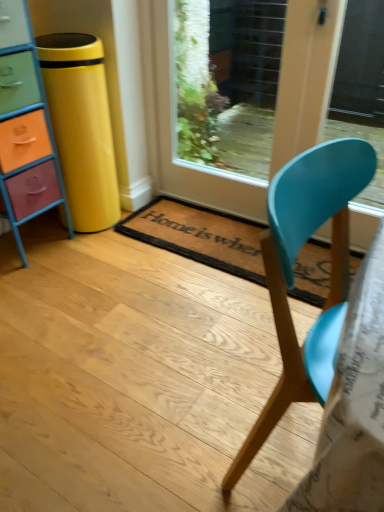
Question: Is brown coir mat at center to the right of wooden glass door at center from the viewer's perspective?

Choices:
 (A) yes
 (B) no

Answer: (B)

Question: Is the depth of brown coir mat at center less than that of wooden glass door at center?

Choices:
 (A) yes
 (B) no

Answer: (B)

Question: Considering the relative sizes of brown coir mat at center and wooden glass door at center in the image provided, is brown coir mat at center bigger than wooden glass door at center?

Choices:
 (A) no
 (B) yes

Answer: (A)

Question: From the image's perspective, is brown coir mat at center beneath wooden glass door at center?

Choices:
 (A) no
 (B) yes

Answer: (B)

Question: From a real-world perspective, is brown coir mat at center on wooden glass door at center?

Choices:
 (A) no
 (B) yes

Answer: (A)

Question: In terms of height, does matte blue chair at center look taller or shorter compared to wooden glass door at center?

Choices:
 (A) short
 (B) tall

Answer: (A)

Question: Considering the positions of matte blue chair at center and wooden glass door at center in the image, is matte blue chair at center bigger or smaller than wooden glass door at center?

Choices:
 (A) big
 (B) small

Answer: (A)

Question: In terms of width, does matte blue chair at center look wider or thinner when compared to wooden glass door at center?

Choices:
 (A) wide
 (B) thin

Answer: (A)

Question: From the image's perspective, relative to wooden glass door at center, is matte blue chair at center above or below?

Choices:
 (A) below
 (B) above

Answer: (A)

Question: From the image's perspective, is wooden glass door at center above or below multicolored painted wood chest of drawers at left?

Choices:
 (A) below
 (B) above

Answer: (B)

Question: Is wooden glass door at center to the left or to the right of multicolored painted wood chest of drawers at left in the image?

Choices:
 (A) right
 (B) left

Answer: (A)

Question: In the image, is wooden glass door at center positioned in front of or behind multicolored painted wood chest of drawers at left?

Choices:
 (A) front
 (B) behind

Answer: (B)

Question: Is wooden glass door at center spatially inside multicolored painted wood chest of drawers at left, or outside of it?

Choices:
 (A) outside
 (B) inside

Answer: (A)

Question: Considering the positions of brown coir mat at center and matte blue chair at center in the image, is brown coir mat at center bigger or smaller than matte blue chair at center?

Choices:
 (A) small
 (B) big

Answer: (A)

Question: Is point (326, 278) positioned closer to the camera than point (347, 158)?

Choices:
 (A) farther
 (B) closer

Answer: (A)